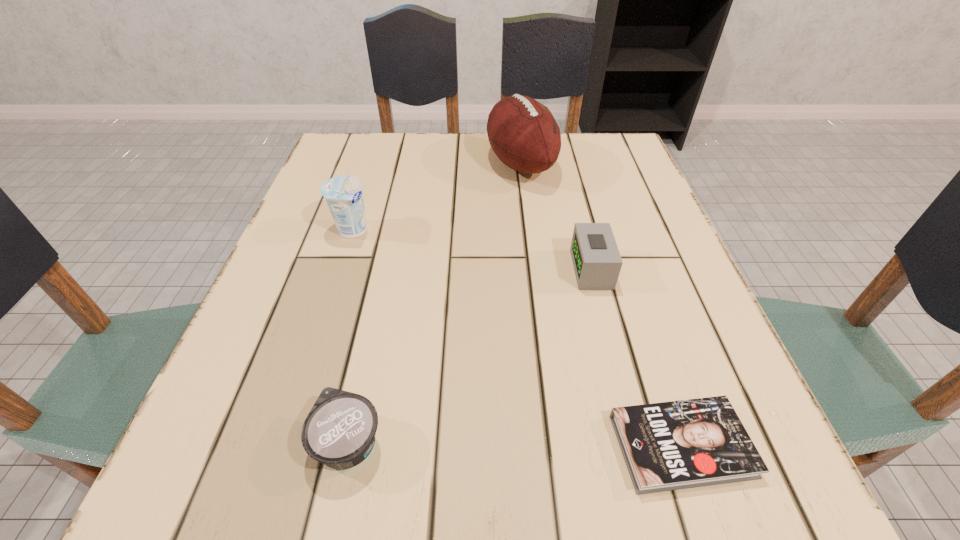
This screenshot has height=540, width=960. In order to click on free space located 0.270m on the right of the second farthest object in this screenshot , I will do [504, 230].

In order to click on free location located 0.280m on the front-facing side of the third tallest object in this screenshot , I will do pyautogui.click(x=423, y=269).

Identify the location of free space located 0.300m on the front-facing side of the third tallest object. Image resolution: width=960 pixels, height=540 pixels. (413, 269).

Find the location of a particular element. The width and height of the screenshot is (960, 540). free location located 0.390m on the front-facing side of the third tallest object is located at coordinates (365, 269).

This screenshot has height=540, width=960. In order to click on vacant area located on the back of the shorter yogurt in this screenshot , I will do `click(393, 242)`.

Find the location of a particular element. The width and height of the screenshot is (960, 540). blank space located 0.100m on the left of the book is located at coordinates (540, 446).

Locate an element on the screen. object that is at the far edge is located at coordinates (522, 132).

Locate an element on the screen. This screenshot has height=540, width=960. yogurt that is at the near edge is located at coordinates (340, 430).

At what (x,y) coordinates should I click in order to perform the action: click on book that is at the near edge. Please return your answer as a coordinate pair (x, y). The width and height of the screenshot is (960, 540). Looking at the image, I should click on (674, 445).

Image resolution: width=960 pixels, height=540 pixels. In order to click on alarm clock that is at the right edge in this screenshot , I will do `click(596, 259)`.